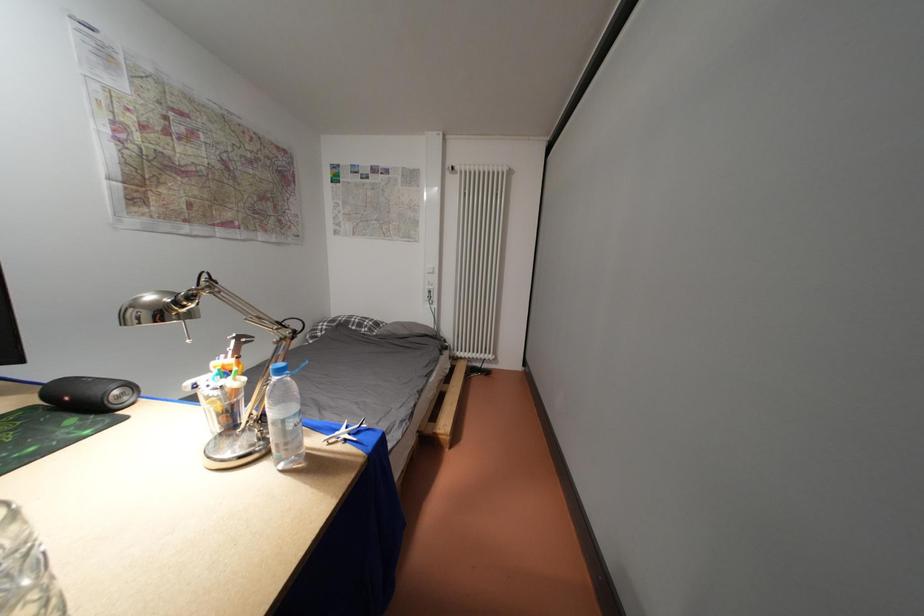
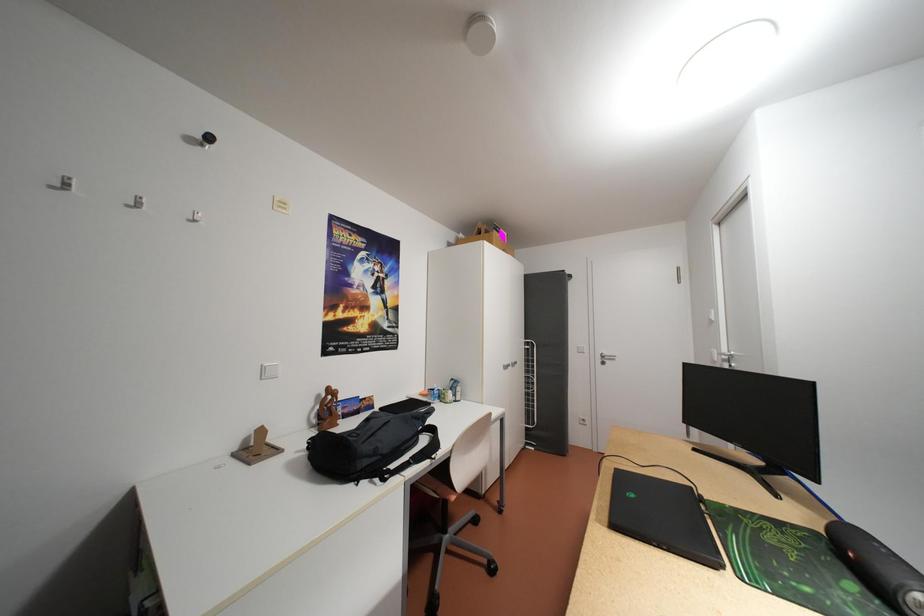
Question: The images are taken continuously from a first-person perspective. In which direction is your viewpoint rotating?

Choices:
 (A) Left
 (B) Right
 (C) Up
 (D) Down

Answer: (A)